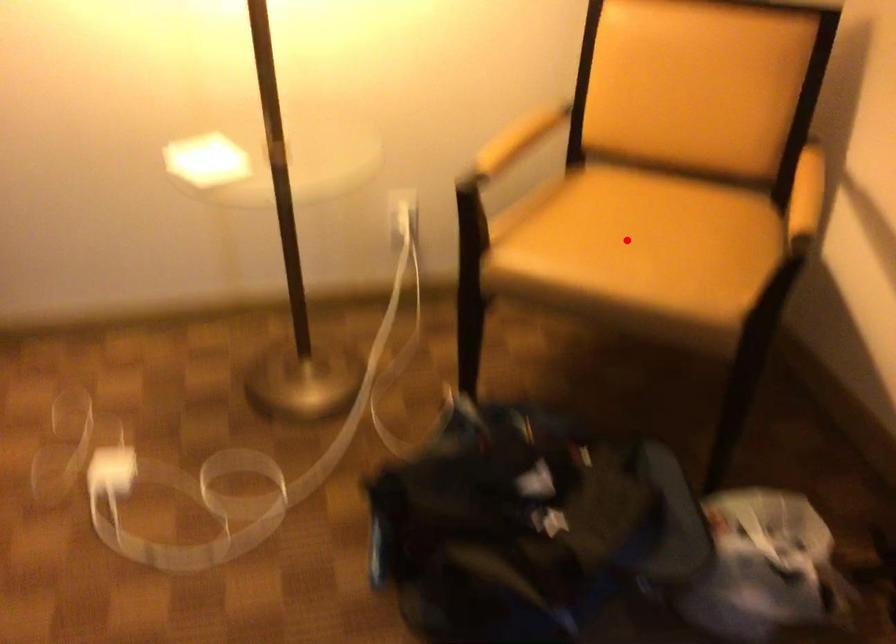
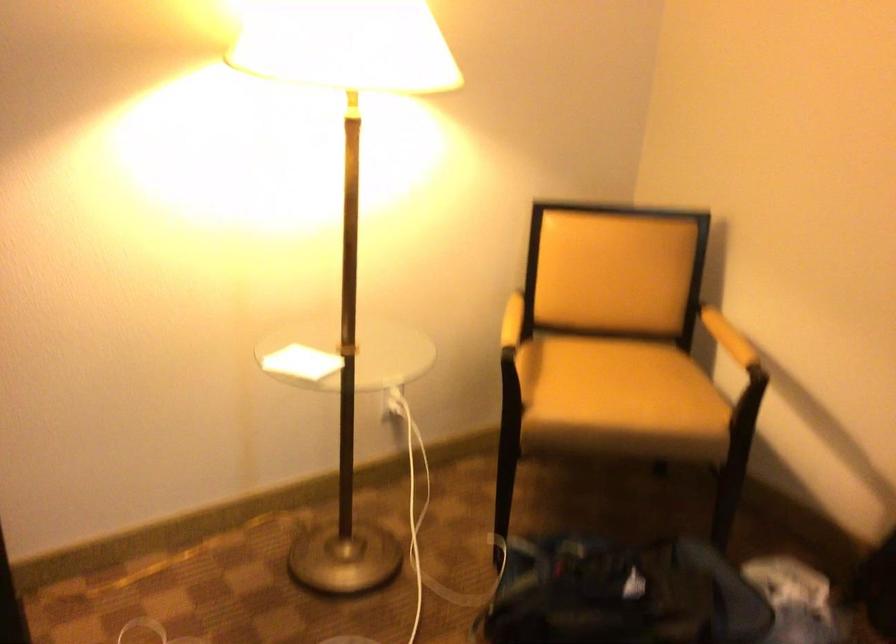
Question: I am providing you with two images of the same scene from different viewpoints. Image1 has a red point marked. In image2, the corresponding 3D location appears at what relative position? Reply with the corresponding letter.

Choices:
 (A) Closer
 (B) Farther

Answer: (B)